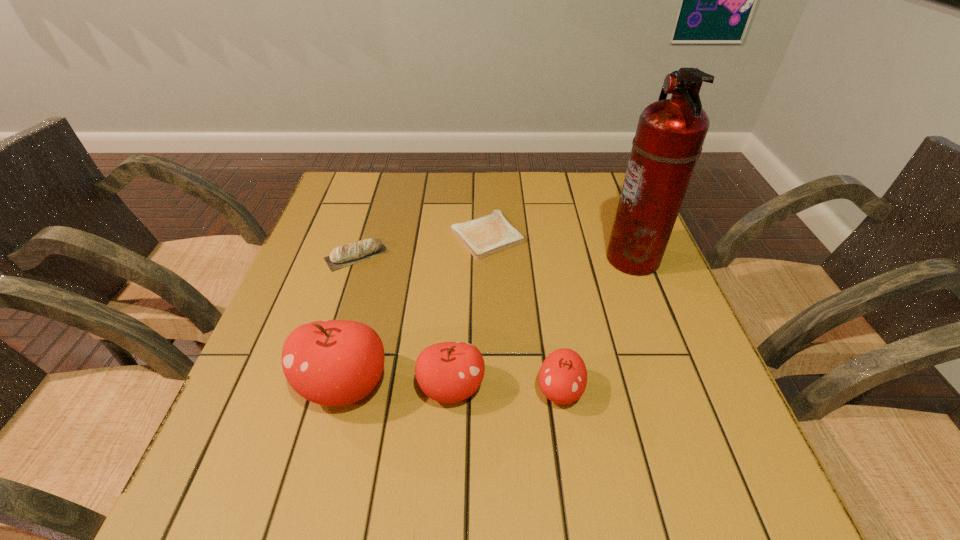
Identify which object is the fifth closest to the toast. Please provide its 2D coordinates. Your answer should be formatted as a tuple, i.e. [(x, y)], where the tuple contains the x and y coordinates of a point satisfying the conditions above.

[(563, 376)]

Identify the location of apple that is the third closest to the shortest object. (563, 376).

Locate which apple is the closest to the second tallest object. Please provide its 2D coordinates. Your answer should be formatted as a tuple, i.e. [(x, y)], where the tuple contains the x and y coordinates of a point satisfying the conditions above.

[(448, 372)]

Where is `free spot that satisfies the following two spatial constraints: 1. on the front side of the shortest apple; 2. on the right side of the second tallest apple`? The image size is (960, 540). free spot that satisfies the following two spatial constraints: 1. on the front side of the shortest apple; 2. on the right side of the second tallest apple is located at coordinates (451, 391).